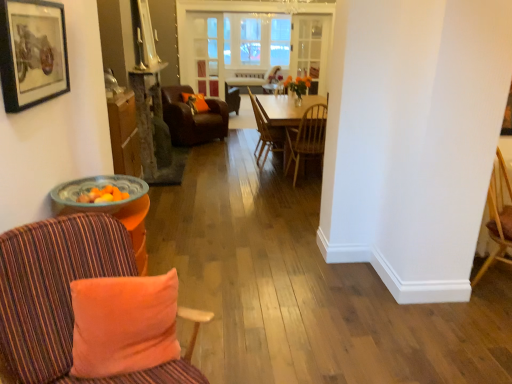
This screenshot has width=512, height=384. I want to click on light wood table at center, so click(x=287, y=108).

The height and width of the screenshot is (384, 512). I want to click on wooden chair at center, which is counted as the 2th chair, starting from the front, so click(x=307, y=138).

What do you see at coordinates (307, 138) in the screenshot?
I see `wooden chair at center, which is counted as the 2th chair, starting from the front` at bounding box center [307, 138].

What do you see at coordinates (32, 53) in the screenshot? I see `matte black picture frame at upper left` at bounding box center [32, 53].

This screenshot has height=384, width=512. What do you see at coordinates (123, 324) in the screenshot?
I see `orange plush pillow at lower left, which is counted as the second pillow, starting from the top` at bounding box center [123, 324].

Where is `wooden chair at center, marked as the 3th chair in a front-to-back arrangement`? wooden chair at center, marked as the 3th chair in a front-to-back arrangement is located at coordinates (266, 132).

What are the coordinates of `orange fabric pillow at center, which appears as the 2th pillow when viewed from the front` in the screenshot? It's located at (195, 102).

This screenshot has width=512, height=384. What are the coordinates of `light wood table at center` in the screenshot? It's located at (287, 108).

Can you confirm if wooden chair at center, which is the 3th chair in back-to-front order, is smaller than orange plush pillow at lower left, which is counted as the second pillow, starting from the top?

No, wooden chair at center, which is the 3th chair in back-to-front order, is not smaller than orange plush pillow at lower left, which is counted as the second pillow, starting from the top.

Which point is more distant from viewer, (304,157) or (140,303)?

The point (304,157) is more distant.

Is wooden chair at center, which is the 3th chair in back-to-front order, closer to the viewer compared to orange plush pillow at lower left, the first pillow viewed from the right?

No, it is behind orange plush pillow at lower left, the first pillow viewed from the right.

The height and width of the screenshot is (384, 512). I want to click on round table that appears on the right of matte black picture frame at upper left, so click(92, 188).

Are translucent glass bowl at left and matte black picture frame at upper left far apart?

translucent glass bowl at left is near matte black picture frame at upper left, not far away.

Considering the relative positions of translucent glass bowl at left and matte black picture frame at upper left in the image provided, is translucent glass bowl at left behind matte black picture frame at upper left?

Yes, the depth of translucent glass bowl at left is greater than that of matte black picture frame at upper left.

From a real-world perspective, who is located higher, translucent glass bowl at left or matte black picture frame at upper left?

matte black picture frame at upper left.

Consider the image. From the image's perspective, is wooden chair at center, which is counted as the 2th chair, starting from the front, positioned above or below wooden chair at center, marked as the 3th chair in a front-to-back arrangement?

Clearly, from the image's perspective, wooden chair at center, which is counted as the 2th chair, starting from the front, is below wooden chair at center, marked as the 3th chair in a front-to-back arrangement.

Is point (297, 136) positioned behind point (258, 110)?

No.

From the picture: Is wooden chair at center, positioned as the 2th chair in back-to-front order, located within wooden chair at center, which is the 3th chair in back-to-front order?

Definitely not — wooden chair at center, positioned as the 2th chair in back-to-front order, is not inside wooden chair at center, which is the 3th chair in back-to-front order.

Is striped fabric chair at left, arranged as the first chair when viewed from the front, taller or shorter than leather armchair at center, acting as the first chair starting from the back?

Clearly, striped fabric chair at left, arranged as the first chair when viewed from the front, is taller compared to leather armchair at center, acting as the first chair starting from the back.

Considering the positions of objects striped fabric chair at left, positioned as the fourth chair in back-to-front order, and leather armchair at center, the fourth chair in the front-to-back sequence, in the image provided, who is more to the right, striped fabric chair at left, positioned as the fourth chair in back-to-front order, or leather armchair at center, the fourth chair in the front-to-back sequence,?

From the viewer's perspective, striped fabric chair at left, positioned as the fourth chair in back-to-front order, appears more on the right side.

Considering the positions of point (64, 306) and point (227, 111), is point (64, 306) closer or farther from the camera than point (227, 111)?

Clearly, point (64, 306) is closer to the camera than point (227, 111).

Locate an element on the screen. The height and width of the screenshot is (384, 512). chair that appears on the left of striped fabric chair at left, positioned as the fourth chair in back-to-front order is located at coordinates (193, 118).

Which object is thinner, translucent glass bowl at left or orange plush pillow at lower left, which is the second pillow in left-to-right order?

orange plush pillow at lower left, which is the second pillow in left-to-right order, is thinner.

Can we say translucent glass bowl at left lies outside orange plush pillow at lower left, which is counted as the second pillow, starting from the top?

Yes, translucent glass bowl at left is outside of orange plush pillow at lower left, which is counted as the second pillow, starting from the top.

From a real-world perspective, is translucent glass bowl at left physically below orange plush pillow at lower left, the 1th pillow when ordered from bottom to top?

No.

Locate an element on the screen. glass door on the right of the striped fabric chair at left, positioned as the fourth chair in back-to-front order is located at coordinates (311, 49).

Does clear glass door at center, which ranks as the 1th glass door in right-to-left order, have a greater width compared to striped fabric chair at left, arranged as the first chair when viewed from the front?

No.

Which is behind, clear glass door at center, acting as the 2th glass door starting from the left, or striped fabric chair at left, positioned as the fourth chair in back-to-front order?

clear glass door at center, acting as the 2th glass door starting from the left, is further away from the camera.

From the image's perspective, is clear glass door at center, which ranks as the 1th glass door in right-to-left order, on striped fabric chair at left, arranged as the first chair when viewed from the front?

Indeed, from the image's perspective, clear glass door at center, which ranks as the 1th glass door in right-to-left order, is shown above striped fabric chair at left, arranged as the first chair when viewed from the front.

Would you consider translucent glass bowl at left to be distant from striped fabric chair at left, positioned as the fourth chair in back-to-front order?

No, translucent glass bowl at left is not far away from striped fabric chair at left, positioned as the fourth chair in back-to-front order.

From a real-world perspective, which is physically above, translucent glass bowl at left or striped fabric chair at left, arranged as the first chair when viewed from the front?

From a 3D spatial view, translucent glass bowl at left is above.

Considering the sizes of translucent glass bowl at left and striped fabric chair at left, positioned as the fourth chair in back-to-front order, in the image, is translucent glass bowl at left wider or thinner than striped fabric chair at left, positioned as the fourth chair in back-to-front order,?

translucent glass bowl at left is thinner than striped fabric chair at left, positioned as the fourth chair in back-to-front order.

Does translucent glass bowl at left turn towards striped fabric chair at left, arranged as the first chair when viewed from the front?

No, translucent glass bowl at left does not turn towards striped fabric chair at left, arranged as the first chair when viewed from the front.

Where is `the 1st chair behind the orange plush pillow at lower left, which appears as the first pillow when viewed from the front, counting from the anchor's position`? The width and height of the screenshot is (512, 384). the 1st chair behind the orange plush pillow at lower left, which appears as the first pillow when viewed from the front, counting from the anchor's position is located at coordinates (307, 138).

Locate an element on the screen. The width and height of the screenshot is (512, 384). picture frame above the translucent glass bowl at left (from a real-world perspective) is located at coordinates (32, 53).

When comparing their distances from orange plush pillow at lower left, which appears as the first pillow when viewed from the front, does clear glass door at center, the first glass door viewed from the left, or translucent glass bowl at left seem closer?

The object closer to orange plush pillow at lower left, which appears as the first pillow when viewed from the front, is translucent glass bowl at left.

Which object lies nearer to the anchor point striped fabric chair at left, arranged as the first chair when viewed from the front, translucent glass bowl at left or wooden chair at center, which is counted as the 2th chair, starting from the front?

Among the two, translucent glass bowl at left is located nearer to striped fabric chair at left, arranged as the first chair when viewed from the front.

Based on their spatial positions, is light wood table at center or leather armchair at center, acting as the first chair starting from the back, closer to matte black picture frame at upper left?

Based on the image, light wood table at center appears to be nearer to matte black picture frame at upper left.

Which object lies nearer to the anchor point wooden chair at center, positioned as the 2th chair in back-to-front order, orange fabric pillow at center, which appears as the 2th pillow when viewed from the front, or striped fabric chair at left, arranged as the first chair when viewed from the front?

orange fabric pillow at center, which appears as the 2th pillow when viewed from the front.

From the image, which object appears to be nearer to orange fabric pillow at center, arranged as the 1th pillow when viewed from the left, clear glass door at center, acting as the 2th glass door starting from the left, or matte black picture frame at upper left?

The object closer to orange fabric pillow at center, arranged as the 1th pillow when viewed from the left, is clear glass door at center, acting as the 2th glass door starting from the left.

Based on their spatial positions, is matte black picture frame at upper left or wooden chair at center, which is counted as the 2th chair, starting from the front, closer to translucent glass bowl at left?

Among the two, matte black picture frame at upper left is located nearer to translucent glass bowl at left.

Which object lies further to the anchor point wooden chair at center, which is the 3th chair in back-to-front order, clear glass door at center, placed as the 2th glass door when sorted from right to left, or orange plush pillow at lower left, which is counted as the second pillow, starting from the top?

clear glass door at center, placed as the 2th glass door when sorted from right to left, is positioned further to the anchor wooden chair at center, which is the 3th chair in back-to-front order.

Considering their positions, is striped fabric chair at left, arranged as the first chair when viewed from the front, positioned closer to orange plush pillow at lower left, the second pillow viewed from the back, than wooden chair at center, marked as the 3th chair in a front-to-back arrangement?

The object closer to orange plush pillow at lower left, the second pillow viewed from the back, is striped fabric chair at left, arranged as the first chair when viewed from the front.

The width and height of the screenshot is (512, 384). I want to click on pillow between orange plush pillow at lower left, which appears as the first pillow when viewed from the front, and clear glass door at center, placed as the 2th glass door when sorted from right to left, in the front-back direction, so click(195, 102).

The image size is (512, 384). Find the location of `round table between matte black picture frame at upper left and wooden chair at center, which is counted as the 2th chair, starting from the front, from front to back`. round table between matte black picture frame at upper left and wooden chair at center, which is counted as the 2th chair, starting from the front, from front to back is located at coordinates (92, 188).

The width and height of the screenshot is (512, 384). Find the location of `picture frame between striped fabric chair at left, arranged as the first chair when viewed from the front, and clear glass door at center, the first glass door viewed from the left, in the front-back direction`. picture frame between striped fabric chair at left, arranged as the first chair when viewed from the front, and clear glass door at center, the first glass door viewed from the left, in the front-back direction is located at coordinates (32, 53).

Find the location of `round table located between striped fabric chair at left, positioned as the fourth chair in back-to-front order, and wooden chair at center, marked as the 3th chair in a front-to-back arrangement, in the depth direction`. round table located between striped fabric chair at left, positioned as the fourth chair in back-to-front order, and wooden chair at center, marked as the 3th chair in a front-to-back arrangement, in the depth direction is located at coordinates (92, 188).